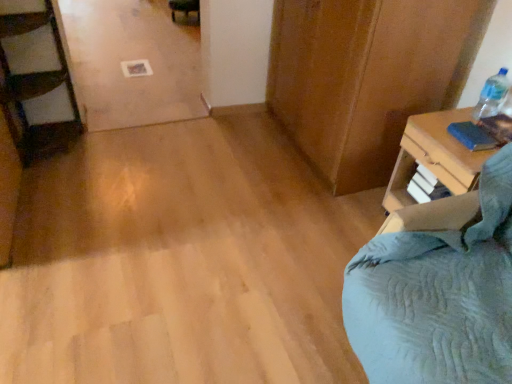
Question: From the image's perspective, is blue fabric at right beneath clear plastic bottle at upper right?

Choices:
 (A) yes
 (B) no

Answer: (A)

Question: Is blue fabric at right placed right next to clear plastic bottle at upper right?

Choices:
 (A) no
 (B) yes

Answer: (A)

Question: Is blue fabric at right aimed at clear plastic bottle at upper right?

Choices:
 (A) yes
 (B) no

Answer: (B)

Question: Does blue fabric at right appear on the right side of clear plastic bottle at upper right?

Choices:
 (A) yes
 (B) no

Answer: (B)

Question: Does blue fabric at right come in front of clear plastic bottle at upper right?

Choices:
 (A) no
 (B) yes

Answer: (B)

Question: Is blue matte book at upper right in front of or behind blue fabric at right in the image?

Choices:
 (A) front
 (B) behind

Answer: (B)

Question: In terms of size, does blue matte book at upper right appear bigger or smaller than blue fabric at right?

Choices:
 (A) small
 (B) big

Answer: (A)

Question: From their relative heights in the image, would you say blue matte book at upper right is taller or shorter than blue fabric at right?

Choices:
 (A) tall
 (B) short

Answer: (B)

Question: In the image, is blue matte book at upper right on the left side or the right side of blue fabric at right?

Choices:
 (A) right
 (B) left

Answer: (B)

Question: Is blue fabric at right spatially inside clear plastic bottle at upper right, or outside of it?

Choices:
 (A) inside
 (B) outside

Answer: (B)

Question: From their relative heights in the image, would you say blue fabric at right is taller or shorter than clear plastic bottle at upper right?

Choices:
 (A) short
 (B) tall

Answer: (B)

Question: In terms of width, does blue fabric at right look wider or thinner when compared to clear plastic bottle at upper right?

Choices:
 (A) thin
 (B) wide

Answer: (B)

Question: From the image's perspective, is blue fabric at right positioned above or below clear plastic bottle at upper right?

Choices:
 (A) above
 (B) below

Answer: (B)

Question: Would you say blue matte book at upper right is to the left or to the right of clear plastic bottle at upper right in the picture?

Choices:
 (A) right
 (B) left

Answer: (B)

Question: From the image's perspective, is blue matte book at upper right positioned above or below clear plastic bottle at upper right?

Choices:
 (A) above
 (B) below

Answer: (B)